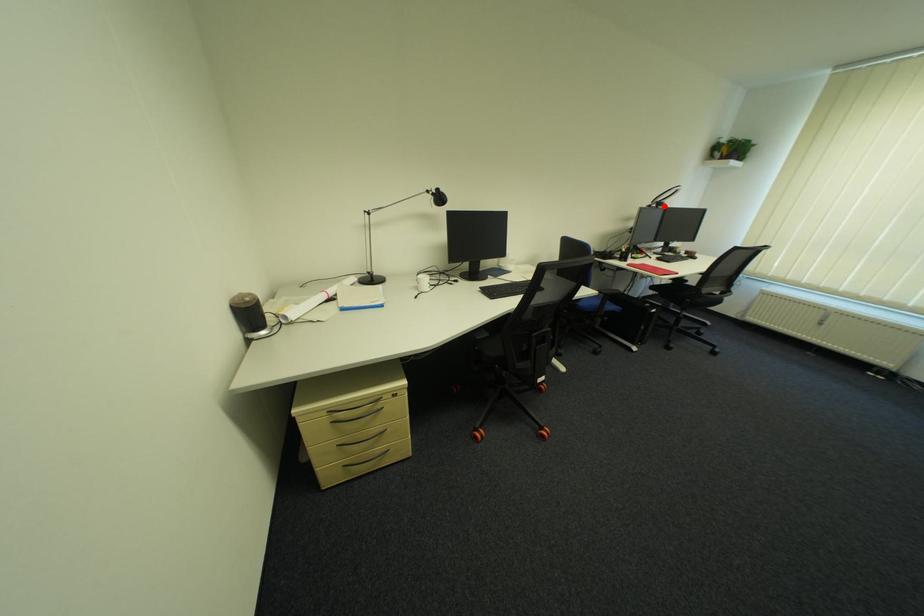
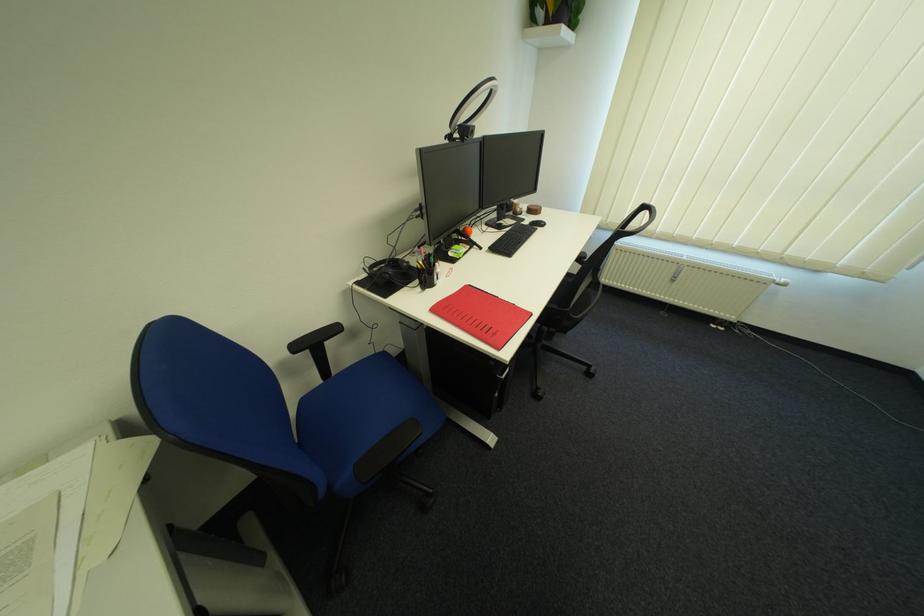
Locate, in the second image, the point that corresponds to the highlighted location in the first image.

(467, 136)